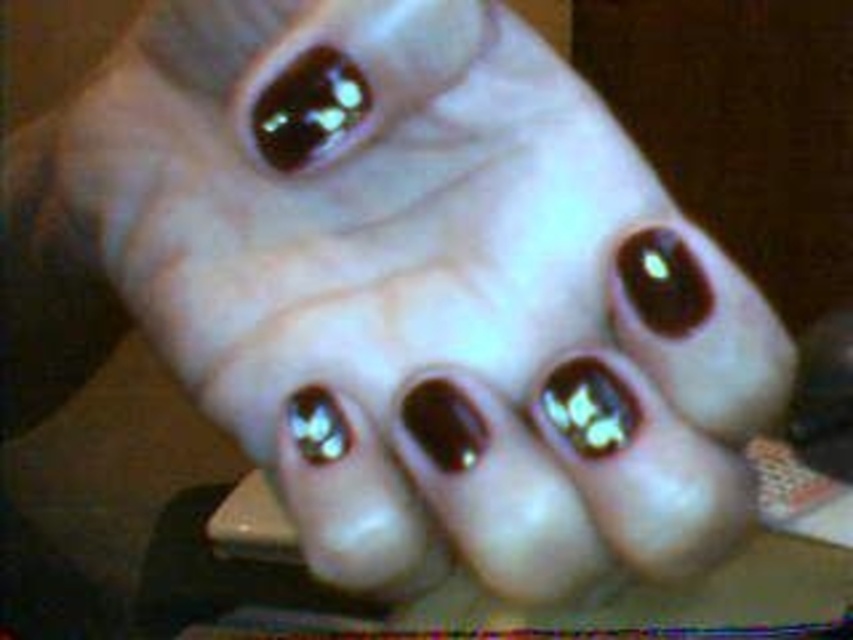
Question: Can you confirm if shiny dark brown nail polish at upper center is positioned to the right of shiny metallic nail polish at center?

Choices:
 (A) no
 (B) yes

Answer: (A)

Question: Which point appears farthest from the camera in this image?

Choices:
 (A) (328, 115)
 (B) (328, 394)

Answer: (B)

Question: Does shiny dark brown nail polish at upper center appear on the right side of shiny metallic nail polish at center?

Choices:
 (A) no
 (B) yes

Answer: (A)

Question: Which point appears farthest from the camera in this image?

Choices:
 (A) coord(271,108)
 (B) coord(306,445)

Answer: (A)

Question: Is the position of shiny dark brown nail polish at upper center more distant than that of shiny metallic nail polish at center?

Choices:
 (A) no
 (B) yes

Answer: (B)